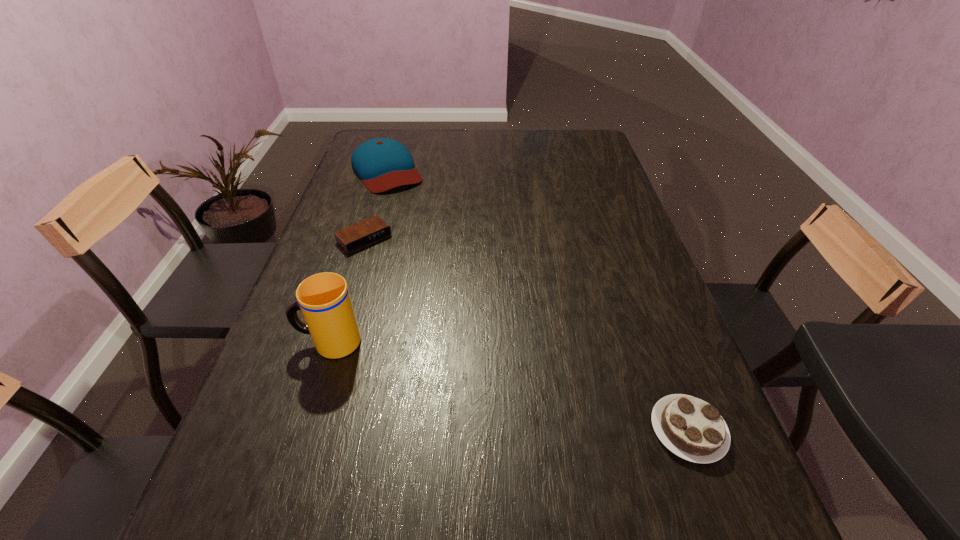
The width and height of the screenshot is (960, 540). I want to click on blank space located on the front face of the shortest object, so click(444, 316).

Where is `vacant space located on the front face of the shortest object`? This screenshot has width=960, height=540. vacant space located on the front face of the shortest object is located at coordinates (454, 326).

Find the location of a particular element. The height and width of the screenshot is (540, 960). vacant region located on the front face of the shortest object is located at coordinates (399, 272).

Image resolution: width=960 pixels, height=540 pixels. Identify the location of vacant space situated 0.280m with the bill of the farthest object facing forward. (430, 240).

Locate an element on the screen. This screenshot has height=540, width=960. free space located with the bill of the farthest object facing forward is located at coordinates [406, 204].

At what (x,y) coordinates should I click in order to perform the action: click on vacant region located 0.150m with the bill of the farthest object facing forward. Please return your answer as a coordinate pair (x, y). The image size is (960, 540). Looking at the image, I should click on (415, 216).

What are the coordinates of `object that is at the far edge` in the screenshot? It's located at (382, 164).

Image resolution: width=960 pixels, height=540 pixels. I want to click on object present at the near edge, so click(691, 428).

At what (x,y) coordinates should I click in order to perform the action: click on cup situated at the left edge. Please return your answer as a coordinate pair (x, y). The image size is (960, 540). Looking at the image, I should click on (324, 299).

In order to click on alarm clock present at the left edge in this screenshot , I will do `click(359, 235)`.